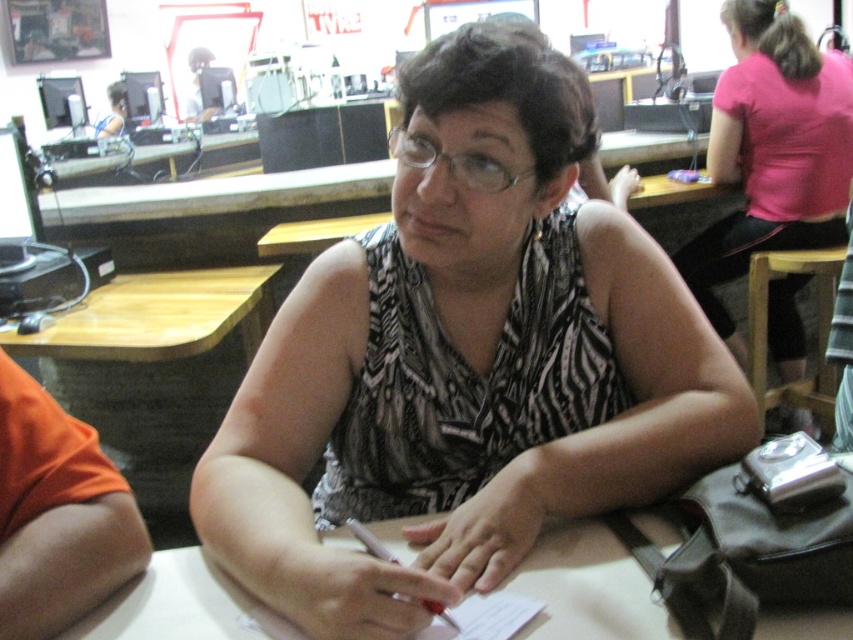
Question: Which of the following is the farthest from the observer?

Choices:
 (A) (375, 524)
 (B) (125, 115)
 (C) (135, 284)
 (D) (811, 168)

Answer: (B)

Question: Is white matte table at center wider than clear plastic glasses at center?

Choices:
 (A) yes
 (B) no

Answer: (A)

Question: Which point appears farthest from the camera in this image?

Choices:
 (A) (631, 586)
 (B) (113, 403)
 (C) (840, 168)

Answer: (B)

Question: Which point appears closest to the camera in this image?

Choices:
 (A) (107, 132)
 (B) (280, 570)

Answer: (B)

Question: Does printed fabric blouse at center have a larger size compared to wooden table at lower left?

Choices:
 (A) no
 (B) yes

Answer: (A)

Question: Is printed fabric blouse at center thinner than clear plastic glasses at center?

Choices:
 (A) yes
 (B) no

Answer: (B)